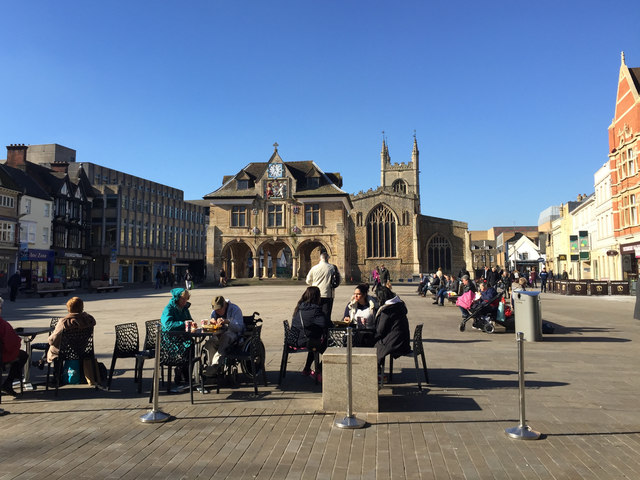
You are a GUI agent. You are given a task and a screenshot of the screen. Output one action in this format:
    pyautogui.click(x=<x>, y=<y>)
    Task: Click on the metal table
    This screenshot has width=640, height=480.
    Given the screenshot: What is the action you would take?
    pyautogui.click(x=202, y=329), pyautogui.click(x=38, y=328), pyautogui.click(x=340, y=326)